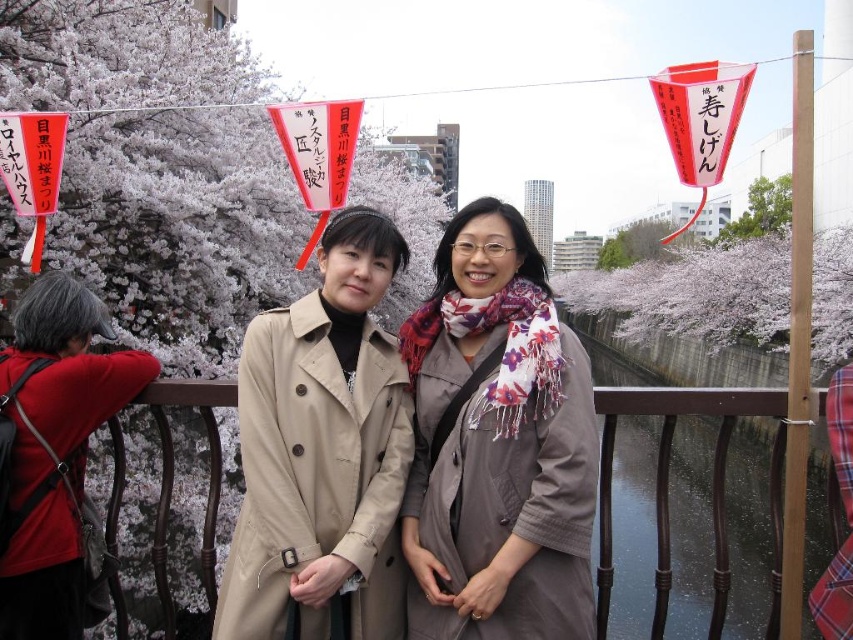
Is beige leather trench coat at center positioned behind white blossoms at upper center?

No, it is not.

Can you confirm if beige leather trench coat at center is positioned below white blossoms at upper center?

Yes, beige leather trench coat at center is below white blossoms at upper center.

Where is `beige leather trench coat at center`? Image resolution: width=853 pixels, height=640 pixels. beige leather trench coat at center is located at coordinates (317, 472).

Image resolution: width=853 pixels, height=640 pixels. Find the location of `beige leather trench coat at center`. beige leather trench coat at center is located at coordinates (317, 472).

Between white blossoms at upper left and floral scarf at center, which one is positioned lower?

floral scarf at center

Measure the distance between white blossoms at upper left and floral scarf at center.

The distance of white blossoms at upper left from floral scarf at center is 111.93 feet.

Does point (425, 276) come behind point (479, 438)?

Yes, it is behind point (479, 438).

At what (x,y) coordinates should I click in order to perform the action: click on white blossoms at upper left. Please return your answer as a coordinate pair (x, y). Looking at the image, I should click on (181, 228).

Does floral scarf at center appear over beige leather trench coat at center?

Yes, floral scarf at center is above beige leather trench coat at center.

Between floral scarf at center and beige leather trench coat at center, which one has less height?

beige leather trench coat at center is shorter.

Measure the distance between floral scarf at center and camera.

The distance of floral scarf at center from camera is 127.55 feet.

Where is `floral scarf at center`? The width and height of the screenshot is (853, 640). floral scarf at center is located at coordinates (497, 445).